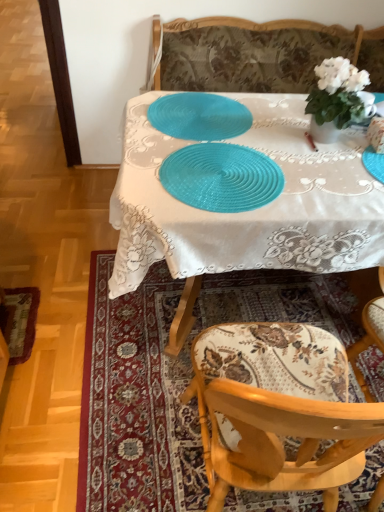
Question: Visually, is white glossy vase at upper right positioned to the left or to the right of wooden floral-patterned chair at lower right?

Choices:
 (A) right
 (B) left

Answer: (A)

Question: Is white glossy vase at upper right bigger or smaller than wooden floral-patterned chair at lower right?

Choices:
 (A) small
 (B) big

Answer: (A)

Question: Which is nearer to the teal woven placemat at center, marked as the 2th tableware in a top-to-bottom arrangement?

Choices:
 (A) blue plastic placemat at center
 (B) wooden floral-patterned chair at lower right
 (C) teal plastic placemat at center, which ranks as the 2th tableware in bottom-to-top order
 (D) wooden chair at lower right
 (E) white glossy vase at upper right

Answer: (A)

Question: Which object is the farthest from the wooden floral-patterned chair at lower right?

Choices:
 (A) teal plastic placemat at center, which is the second tableware in front-to-back order
 (B) blue plastic placemat at center
 (C) white glossy vase at upper right
 (D) wooden chair at lower right
 (E) teal woven placemat at center, marked as the 2th tableware in a top-to-bottom arrangement

Answer: (C)